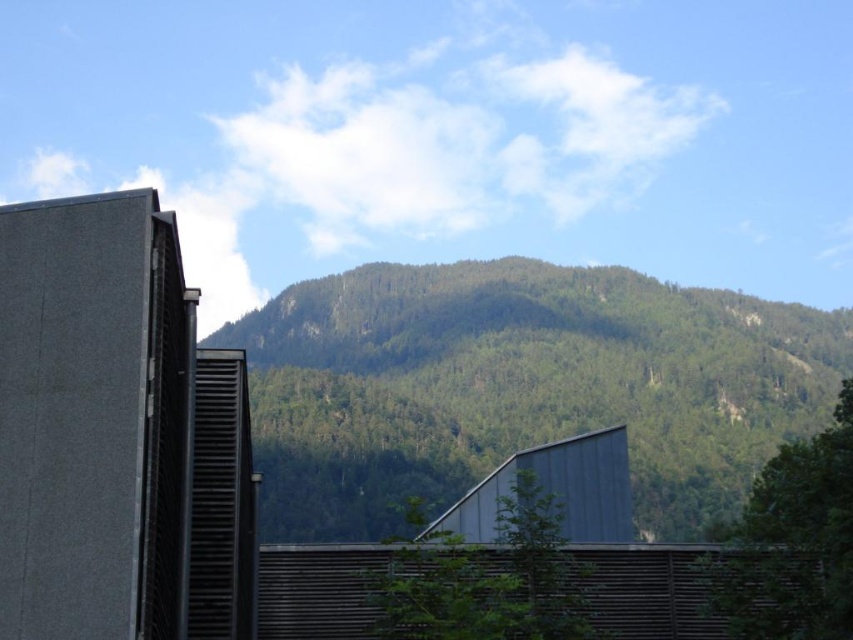
Question: Which object is farther from the camera taking this photo?

Choices:
 (A) green leafy tree at center
 (B) green leafy tree at right
 (C) green forested mountain at center

Answer: (C)

Question: Does green forested mountain at center appear over green leafy tree at center?

Choices:
 (A) yes
 (B) no

Answer: (A)

Question: Among these points, which one is nearest to the camera?

Choices:
 (A) click(289, 429)
 (B) click(532, 566)

Answer: (B)

Question: Can you confirm if green leafy tree at right is smaller than green leafy tree at center?

Choices:
 (A) no
 (B) yes

Answer: (A)

Question: Which point is closer to the camera?

Choices:
 (A) green leafy tree at center
 (B) green leafy tree at right

Answer: (A)

Question: Does green forested mountain at center come behind green leafy tree at right?

Choices:
 (A) no
 (B) yes

Answer: (B)